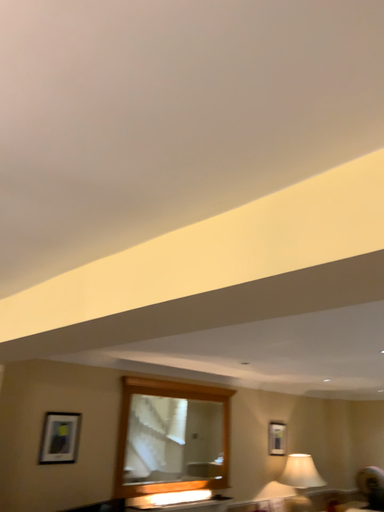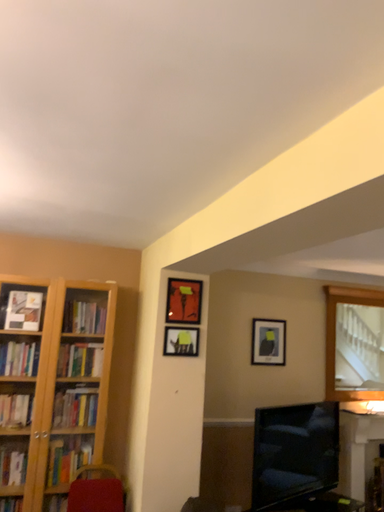
Question: Which way did the camera rotate in the video?

Choices:
 (A) rotated downward
 (B) rotated upward

Answer: (A)